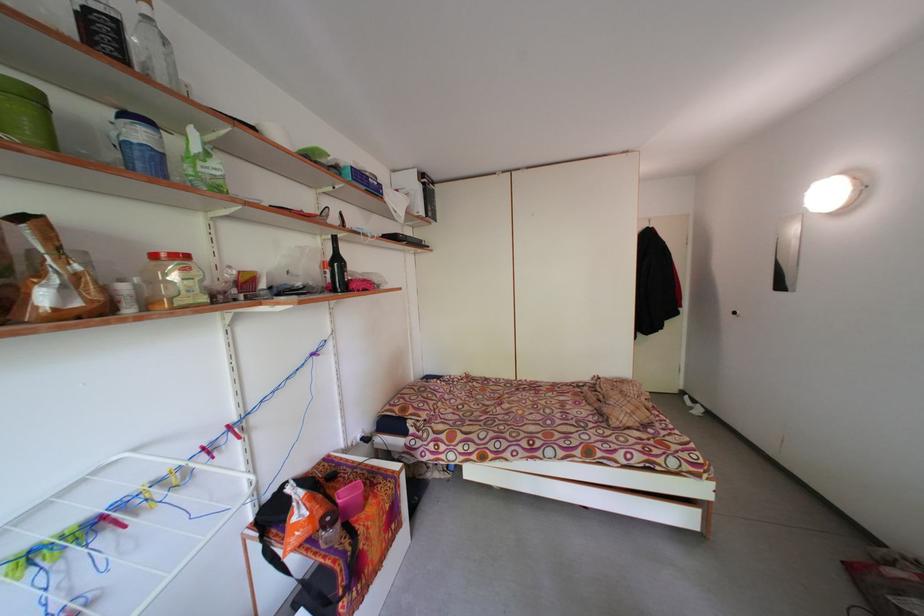
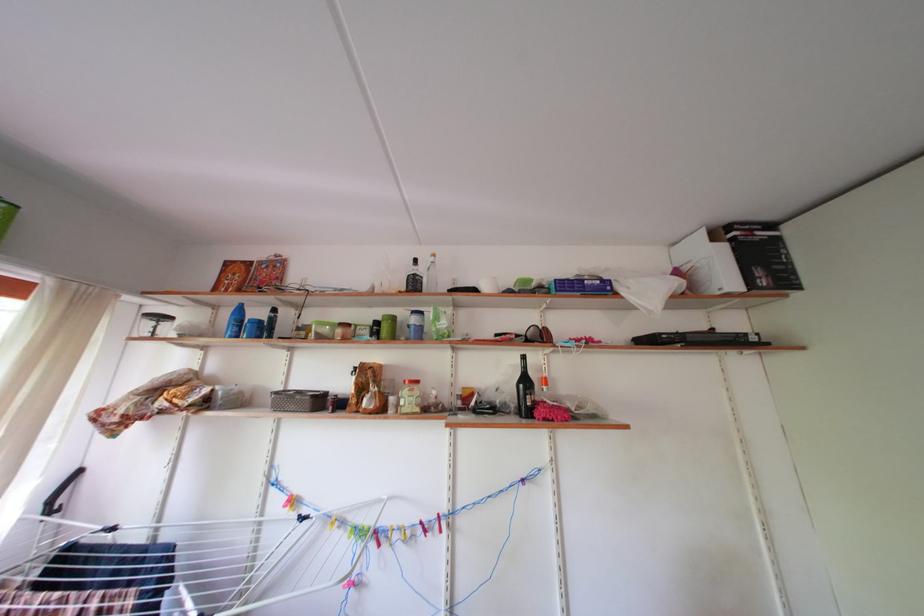
Find the pixel in the second image that matches the point at 428,187 in the first image.

(721, 246)